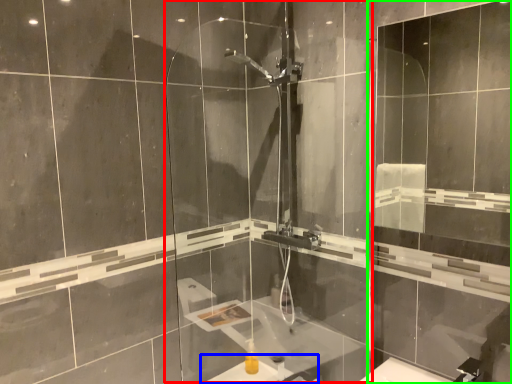
Question: Which is farther away from screen door (highlighted by a red box)? sink (highlighted by a blue box) or screen door (highlighted by a green box)?

Choices:
 (A) sink
 (B) screen door

Answer: (B)